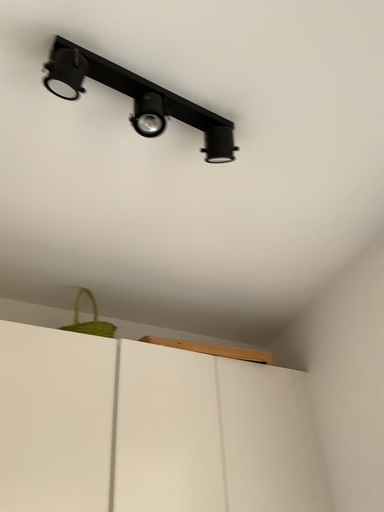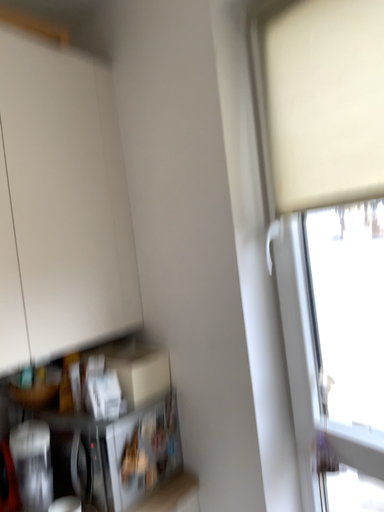
Question: How did the camera likely rotate when shooting the video?

Choices:
 (A) rotated right
 (B) rotated left

Answer: (A)